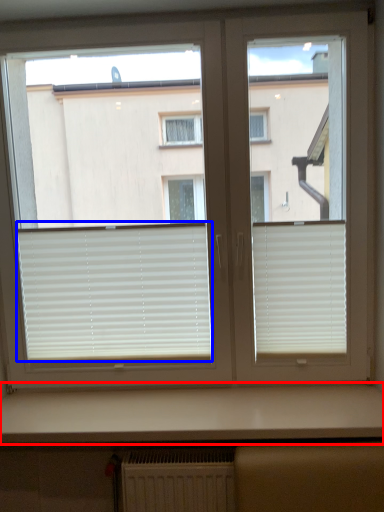
Question: Which object is further to the camera taking this photo, counter top (highlighted by a red box) or window blind (highlighted by a blue box)?

Choices:
 (A) counter top
 (B) window blind

Answer: (B)